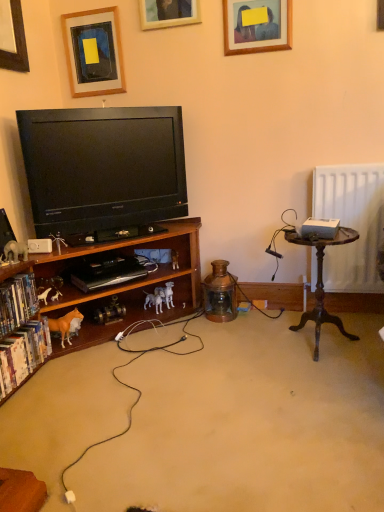
Image resolution: width=384 pixels, height=512 pixels. I want to click on vacant space that is in between brown matte horse at lower left and wooden vintage table at right, so click(210, 347).